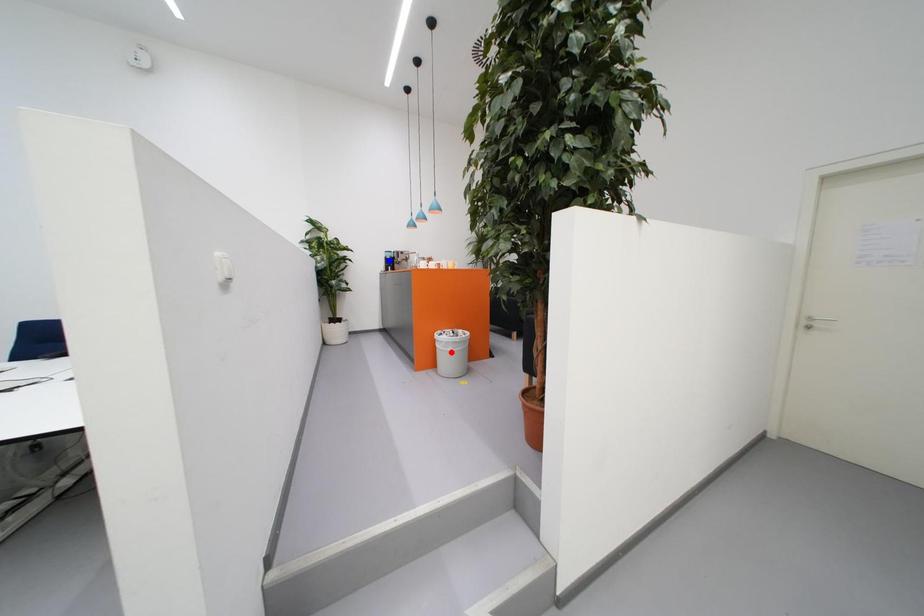
Question: Two points are marked on the image. Which point is closer to the camera?

Choices:
 (A) Blue point is closer.
 (B) Red point is closer.

Answer: (B)